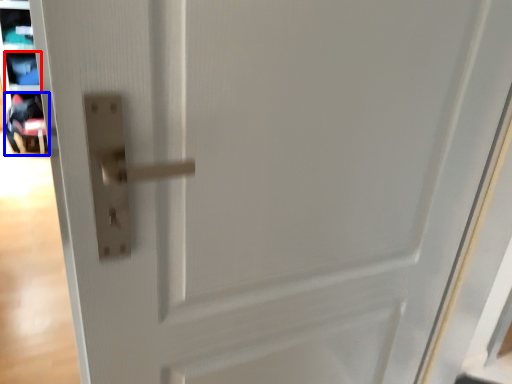
Question: Which of the following is the closest to the observer, shelf (highlighted by a red box) or baby carriage (highlighted by a blue box)?

Choices:
 (A) shelf
 (B) baby carriage

Answer: (B)